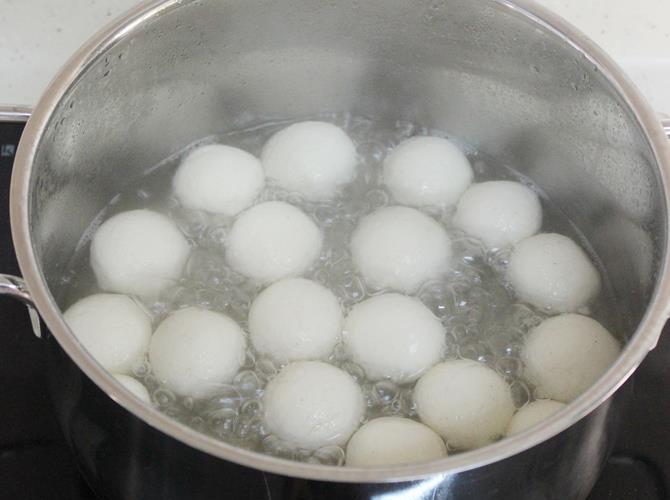
Identify the location of stove. The image size is (670, 500). (639, 487).